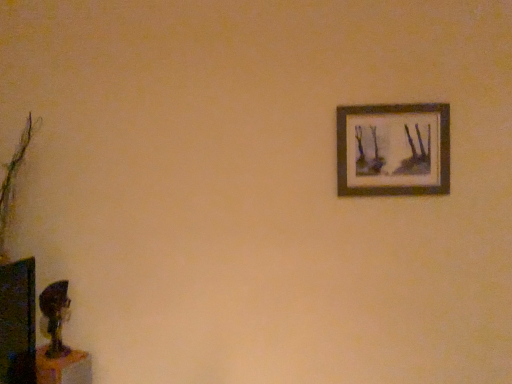
Locate an element on the screen. The image size is (512, 384). wooden frame at upper right is located at coordinates (393, 150).

Image resolution: width=512 pixels, height=384 pixels. Describe the element at coordinates (393, 150) in the screenshot. I see `wooden frame at upper right` at that location.

Image resolution: width=512 pixels, height=384 pixels. What do you see at coordinates (63, 367) in the screenshot?
I see `wooden table at lower left` at bounding box center [63, 367].

Identify the location of wooden table at lower left. The height and width of the screenshot is (384, 512). (63, 367).

Locate an element on the screen. wooden frame at upper right is located at coordinates (393, 150).

Which is more to the left, wooden table at lower left or wooden frame at upper right?

wooden table at lower left is more to the left.

In the scene shown: Is wooden table at lower left closer to camera compared to wooden frame at upper right?

Yes, wooden table at lower left is closer to the camera.

Does point (39, 353) lie behind point (385, 192)?

No, it is not.

From the image's perspective, is wooden table at lower left under wooden frame at upper right?

Yes, from the image's perspective, wooden table at lower left is below wooden frame at upper right.

From the picture: From a real-world perspective, between wooden table at lower left and wooden frame at upper right, who is vertically lower?

In real-world perspective, wooden table at lower left is lower.

Which object is wider, wooden table at lower left or wooden frame at upper right?

With larger width is wooden table at lower left.

Does wooden table at lower left have a greater height compared to wooden frame at upper right?

Incorrect, the height of wooden table at lower left is not larger of that of wooden frame at upper right.

Is wooden table at lower left smaller than wooden frame at upper right?

Correct, wooden table at lower left occupies less space than wooden frame at upper right.

Is wooden table at lower left located outside wooden frame at upper right?

wooden table at lower left lies outside wooden frame at upper right's area.

Consider the image. Is the surface of wooden table at lower left in direct contact with wooden frame at upper right?

They are not placed beside each other.

Is wooden table at lower left oriented towards wooden frame at upper right?

No.

Can you tell me how much wooden table at lower left and wooden frame at upper right differ in facing direction?

The angle between the facing direction of wooden table at lower left and the facing direction of wooden frame at upper right is 69 degrees.

Locate an element on the screen. This screenshot has height=384, width=512. picture frame above the wooden table at lower left (from a real-world perspective) is located at coordinates (393, 150).

Is wooden frame at upper right to the right of wooden table at lower left from the viewer's perspective?

Yes, wooden frame at upper right is to the right of wooden table at lower left.

Does wooden frame at upper right come behind wooden table at lower left?

Yes, it is behind wooden table at lower left.

Is point (395, 177) closer or farther from the camera than point (50, 362)?

Clearly, point (395, 177) is more distant from the camera than point (50, 362).

From the image's perspective, is wooden frame at upper right above or below wooden table at lower left?

Based on their image positions, wooden frame at upper right is located above wooden table at lower left.

From a real-world perspective, is wooden frame at upper right located beneath wooden table at lower left?

Actually, wooden frame at upper right is physically above wooden table at lower left in the real world.

In terms of width, does wooden frame at upper right look wider or thinner when compared to wooden table at lower left?

Considering their sizes, wooden frame at upper right looks slimmer than wooden table at lower left.

Between wooden frame at upper right and wooden table at lower left, which one has less height?

wooden table at lower left is shorter.

Considering the relative sizes of wooden frame at upper right and wooden table at lower left in the image provided, is wooden frame at upper right smaller than wooden table at lower left?

No.

Is wooden table at lower left surrounded by wooden frame at upper right?

No, wooden table at lower left is not inside wooden frame at upper right.

Is wooden frame at upper right positioned far away from wooden table at lower left?

Yes, wooden frame at upper right and wooden table at lower left are located far from each other.

Is wooden table at lower left at the back of wooden frame at upper right?

wooden frame at upper right does not have its back to wooden table at lower left.

How different are the orientations of wooden frame at upper right and wooden table at lower left in degrees?

69 degrees separate the facing orientations of wooden frame at upper right and wooden table at lower left.

Where is `table beneath the wooden frame at upper right (from a real-world perspective)`? table beneath the wooden frame at upper right (from a real-world perspective) is located at coordinates (63, 367).

I want to click on picture frame that appears above the wooden table at lower left (from the image's perspective), so click(393, 150).

Locate an element on the screen. The image size is (512, 384). table in front of the wooden frame at upper right is located at coordinates pyautogui.click(x=63, y=367).